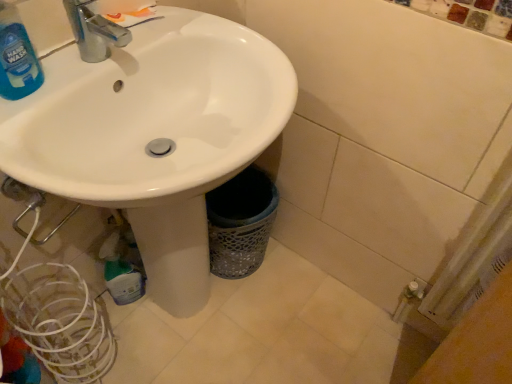
Question: In the image, is blue translucent liquid at upper left on the left side or the right side of white glossy sink at center?

Choices:
 (A) right
 (B) left

Answer: (B)

Question: Based on their sizes in the image, would you say blue translucent liquid at upper left is bigger or smaller than white glossy sink at center?

Choices:
 (A) small
 (B) big

Answer: (A)

Question: Is blue translucent liquid at upper left inside the boundaries of white glossy sink at center, or outside?

Choices:
 (A) inside
 (B) outside

Answer: (A)

Question: Does point (169, 64) appear closer or farther from the camera than point (17, 61)?

Choices:
 (A) closer
 (B) farther

Answer: (B)

Question: From a real-world perspective, is white glossy sink at center above or below blue translucent liquid at upper left?

Choices:
 (A) below
 (B) above

Answer: (A)

Question: From the image's perspective, is white glossy sink at center above or below blue translucent liquid at upper left?

Choices:
 (A) above
 (B) below

Answer: (B)

Question: Considering the positions of white glossy sink at center and blue translucent liquid at upper left in the image, is white glossy sink at center wider or thinner than blue translucent liquid at upper left?

Choices:
 (A) thin
 (B) wide

Answer: (B)